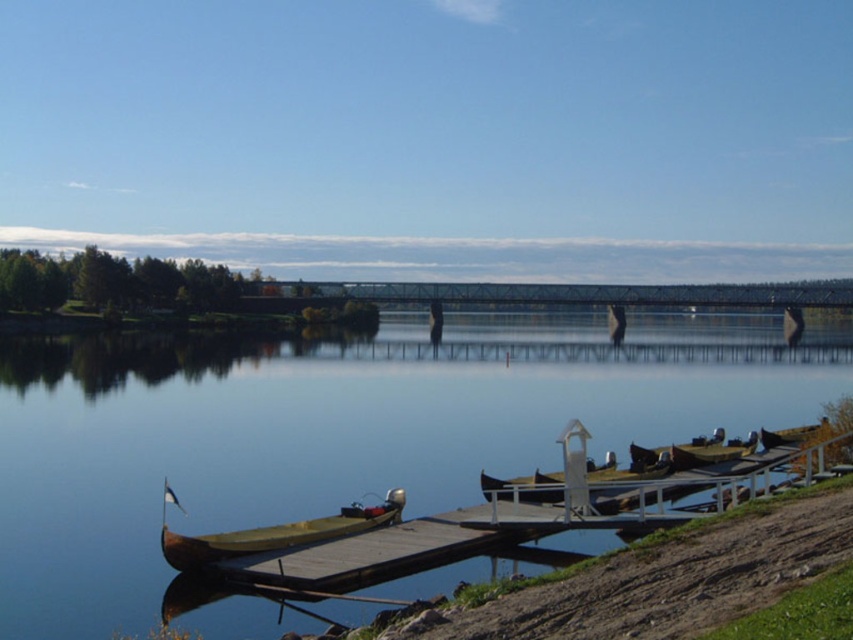
Question: Which object is closer to the camera taking this photo?

Choices:
 (A) yellow wood canoe at lower left
 (B) brown dirt at lower right
 (C) smooth blue water at center

Answer: (B)

Question: Which of the following is the closest to the observer?

Choices:
 (A) (358, 522)
 (B) (314, 394)

Answer: (A)

Question: Is the position of brown dirt at lower right more distant than that of yellow wood canoe at lower left?

Choices:
 (A) yes
 (B) no

Answer: (B)

Question: Is smooth blue water at center above yellow wood canoe at lower left?

Choices:
 (A) no
 (B) yes

Answer: (B)

Question: Where is smooth blue water at center located in relation to brown dirt at lower right in the image?

Choices:
 (A) below
 (B) above

Answer: (B)

Question: Which object is the closest to the smooth blue water at center?

Choices:
 (A) brown dirt at lower right
 (B) yellow wood canoe at lower left

Answer: (B)